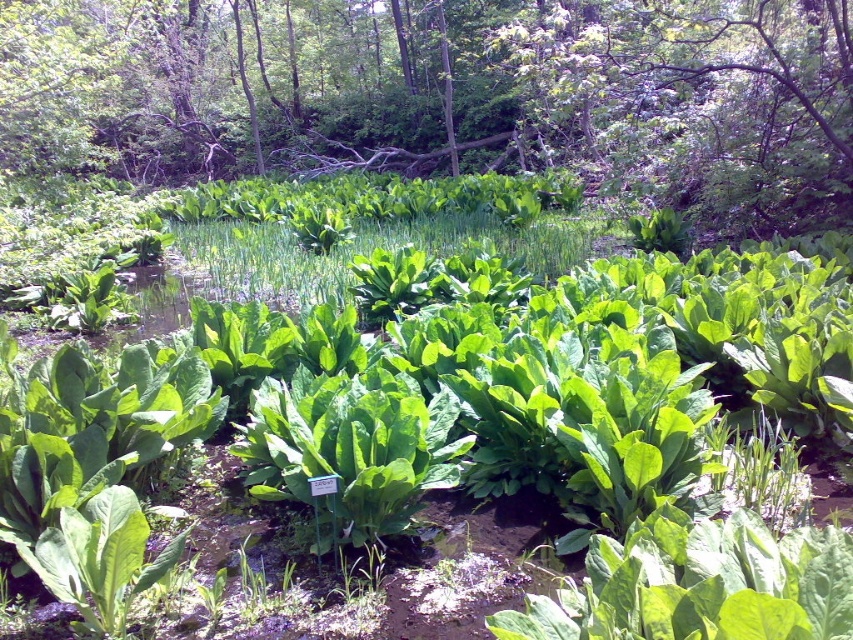
Is green leafy plant at center taller than green leafy grass at center?

Indeed, green leafy plant at center has a greater height compared to green leafy grass at center.

Is green leafy plant at center above green leafy grass at center?

Indeed, green leafy plant at center is positioned over green leafy grass at center.

Who is more forward, (271, 42) or (509, 230)?

Point (509, 230) is in front.

Where is `green leafy plant at center`? This screenshot has height=640, width=853. green leafy plant at center is located at coordinates (445, 93).